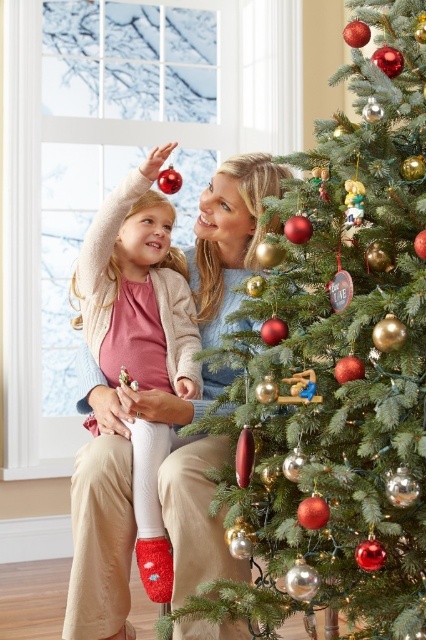
You are a parent holding a child who wants to reach the top of the Christmas tree. The child is standing at point (422, 45). Can the child reach the top of the tree if they stretch their arms upward?

The distance between the child at point (422, 45) and the top of the Christmas tree is 1.61 meters. Since the average height of a child is much less than 1.61 meters, the child cannot reach the top of the tree by stretching their arms upward.

You are a photographer trying to capture a closeup of the shiny gold ornaments at right and the matte pink sweater at upper left. Can you fit both in the frame if your camera has a maximum width of 1 meter?

The shiny gold ornaments at right might be wider than the matte pink sweater at upper left, but since the exact width isn

You are a photographer trying to capture a closeup of the shiny gold ornaments at right and the matte pink sweater at upper left. Which object should you focus on first if you want to ensure both are in focus without moving the camera?

You should focus on the shiny gold ornaments at right first because it is located above the matte pink sweater at upper left, so adjusting focus for the higher object ensures the lower one will also be in focus.